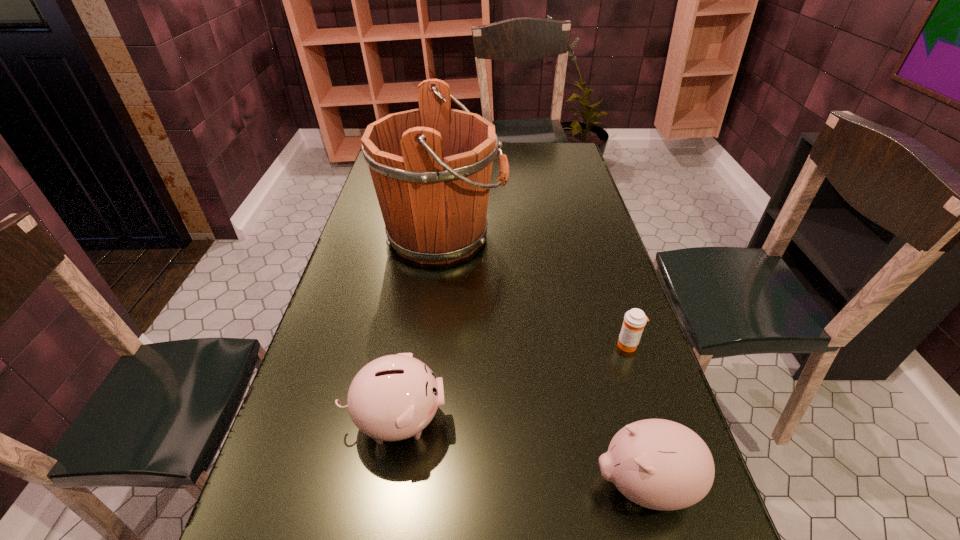
At what (x,y) coordinates should I click in order to perform the action: click on the farthest object. Please return your answer as a coordinate pair (x, y). Image resolution: width=960 pixels, height=540 pixels. Looking at the image, I should click on pos(431,167).

This screenshot has height=540, width=960. Find the location of `the tallest object`. the tallest object is located at coordinates click(431, 167).

The height and width of the screenshot is (540, 960). What are the coordinates of `the left piggy bank` in the screenshot? It's located at (394, 397).

Where is `the right piggy bank`? This screenshot has height=540, width=960. the right piggy bank is located at coordinates (659, 464).

Find the location of a particular element. Image resolution: width=960 pixels, height=540 pixels. medicine is located at coordinates (634, 321).

Where is `the second farthest object`? This screenshot has width=960, height=540. the second farthest object is located at coordinates (634, 321).

At what (x,y) coordinates should I click in order to perform the action: click on free space located 0.320m with the handle on the side of the tallest object. Please return your answer as a coordinate pair (x, y). Image resolution: width=960 pixels, height=540 pixels. Looking at the image, I should click on (607, 235).

You are a GUI agent. You are given a task and a screenshot of the screen. Output one action in this format:
    pyautogui.click(x=<x>, y=<y>)
    Task: Click on the vacant space located 0.110m on the left of the left piggy bank
    The width and height of the screenshot is (960, 540).
    Given the screenshot: What is the action you would take?
    pyautogui.click(x=292, y=420)

Locate an element on the screen. The width and height of the screenshot is (960, 540). free space located at the snout of the right piggy bank is located at coordinates (491, 484).

This screenshot has height=540, width=960. What are the coordinates of `free spot located 0.070m at the snout of the right piggy bank` in the screenshot? It's located at (555, 484).